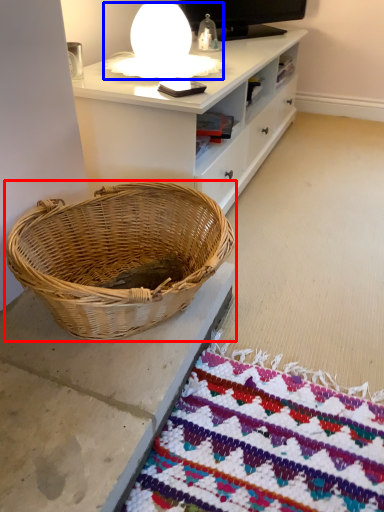
Question: Which object appears farthest to the camera in this image, picnic basket (highlighted by a red box) or table lamp (highlighted by a blue box)?

Choices:
 (A) picnic basket
 (B) table lamp

Answer: (B)